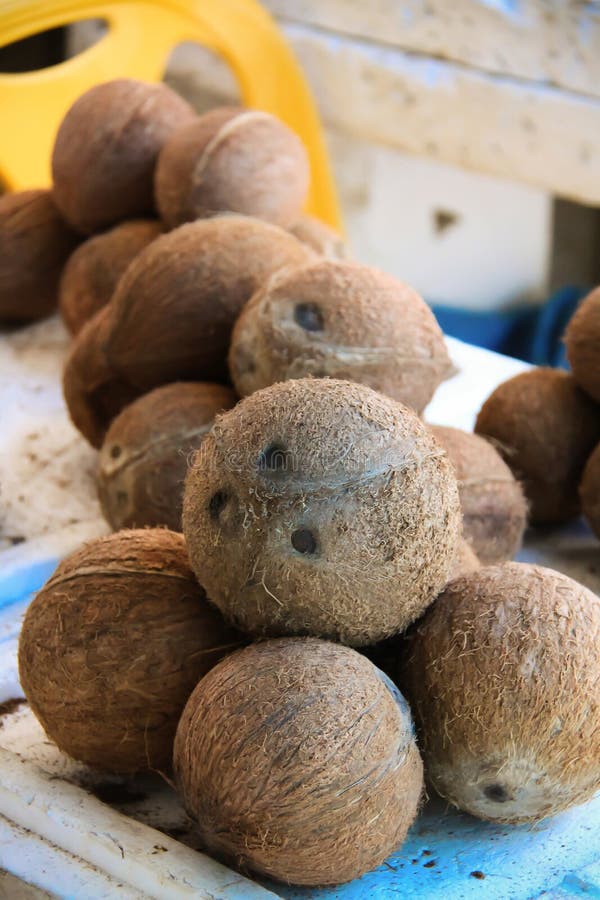
Where is `holes in yellow chair`? holes in yellow chair is located at coordinates (61, 43), (200, 85), (2, 184).